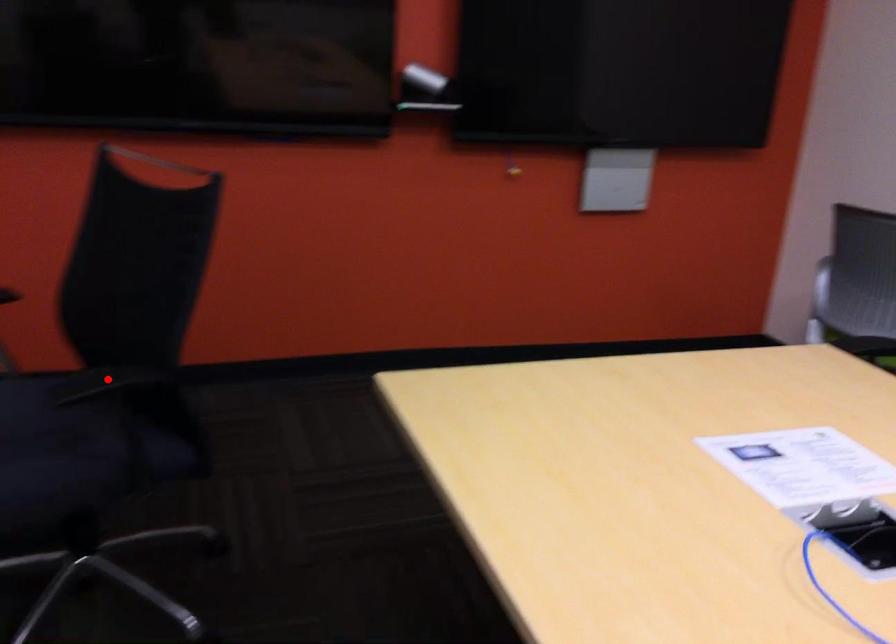
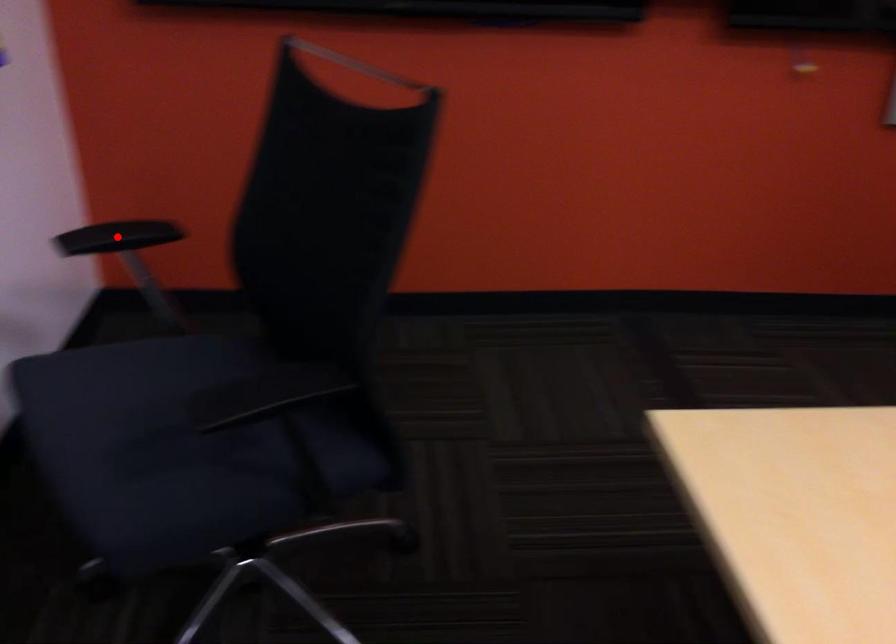
I am providing you with two images of the same scene from different viewpoints. A red point is marked on the first image and another point is marked on the second image. Is the marked point in image1 the same physical position as the marked point in image2?

No